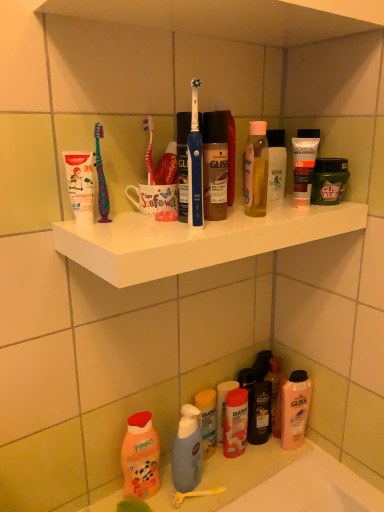
Locate an element on the screen. The image size is (384, 512). free space that is in between green matte hair mask at upper right, which is the 5th toiletry from bottom to top, and blue plastic toothbrush at center is located at coordinates (260, 218).